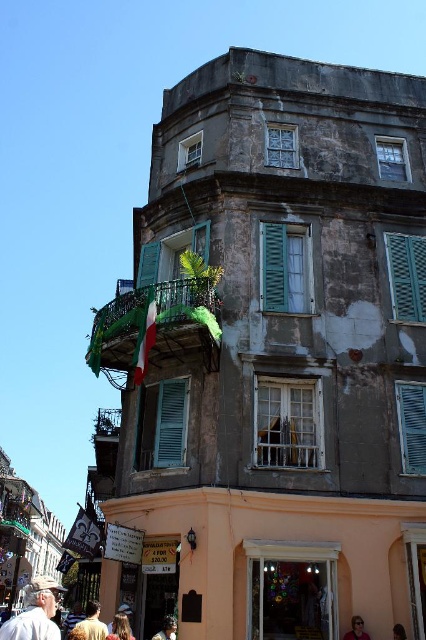
In the scene shown: Is brown leather jacket at lower left thinner than blonde hair at lower center?

No, brown leather jacket at lower left is not thinner than blonde hair at lower center.

Who is positioned more to the left, brown leather jacket at lower left or blonde hair at lower center?

From the viewer's perspective, brown leather jacket at lower left appears more on the left side.

Between point (89, 609) and point (123, 621), which one is positioned in front?

Point (89, 609) is more forward.

What are the coordinates of `brown leather jacket at lower left` in the screenshot? It's located at (92, 624).

Which is above, white cotton shirt at lower left or blonde hair at lower center?

Positioned higher is blonde hair at lower center.

Is white cotton shirt at lower left taller than blonde hair at lower center?

Yes, white cotton shirt at lower left is taller than blonde hair at lower center.

Does point (13, 636) come closer to viewer compared to point (115, 630)?

That is True.

You are a GUI agent. You are given a task and a screenshot of the screen. Output one action in this format:
    pyautogui.click(x=<x>, y=<y>)
    Task: Click on the white cotton shirt at lower left
    The image size is (426, 640).
    Given the screenshot: What is the action you would take?
    pyautogui.click(x=34, y=612)

Can you confirm if green painted wood at center is positioned to the right of brown hair at lower right?

No, green painted wood at center is not to the right of brown hair at lower right.

Does green painted wood at center have a larger size compared to brown hair at lower right?

Correct, green painted wood at center is larger in size than brown hair at lower right.

Describe the element at coordinates (170, 422) in the screenshot. I see `green painted wood at center` at that location.

Find the location of a particular element. Image resolution: width=426 pixels, height=640 pixels. green painted wood at center is located at coordinates (170, 422).